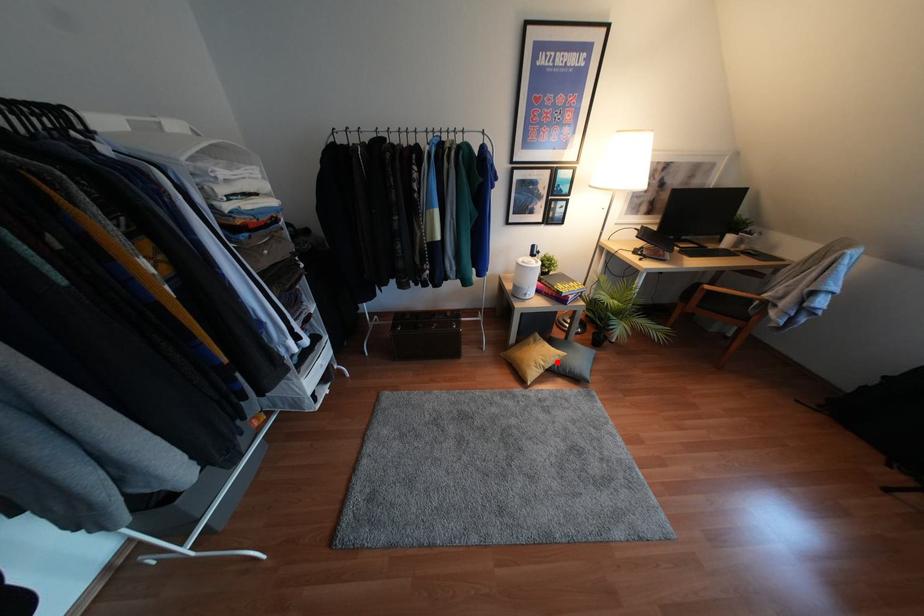
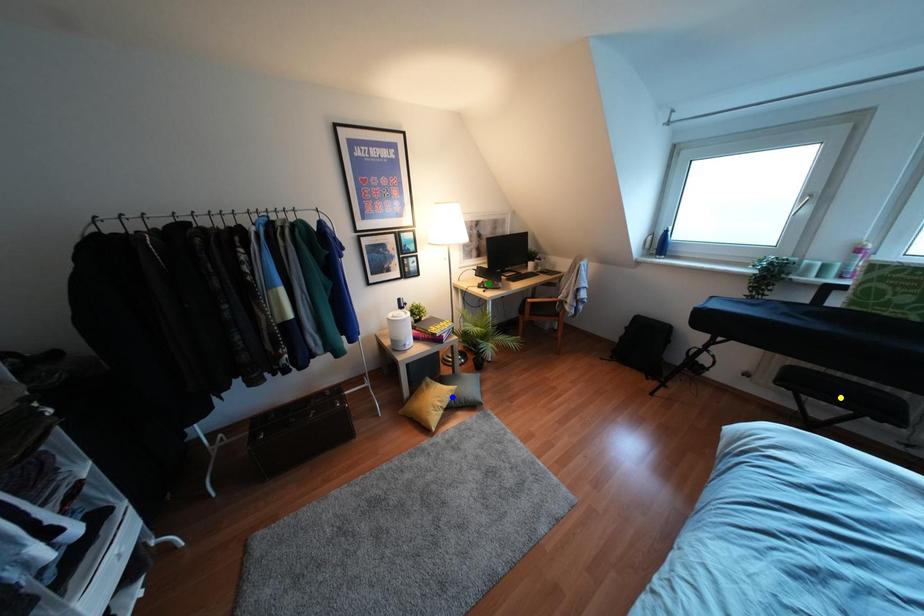
Question: I am providing you with two images of the same scene from different viewpoints. A red point is marked on the first image. You are given multiple points on the second image. Which point in image 2 is actually the same real-world point as the red point in image 1?

Choices:
 (A) green point
 (B) yellow point
 (C) blue point

Answer: (C)